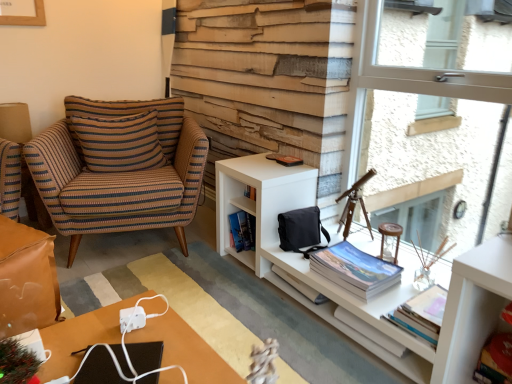
Question: Is hardcover book at lower right, which is counted as the 4th book, starting from the left, inside transparent glass window at upper right?

Choices:
 (A) no
 (B) yes

Answer: (A)

Question: Considering the relative positions of transparent glass window at upper right and hardcover book at lower right, which is counted as the 4th book, starting from the left, in the image provided, is transparent glass window at upper right to the left of hardcover book at lower right, which is counted as the 4th book, starting from the left, from the viewer's perspective?

Choices:
 (A) no
 (B) yes

Answer: (B)

Question: From the image's perspective, is transparent glass window at upper right located beneath hardcover book at lower right, which is counted as the 4th book, starting from the left?

Choices:
 (A) no
 (B) yes

Answer: (A)

Question: Is transparent glass window at upper right completely or partially outside of hardcover book at lower right, which is counted as the 4th book, starting from the left?

Choices:
 (A) no
 (B) yes

Answer: (B)

Question: Considering the relative sizes of transparent glass window at upper right and hardcover book at lower right, placed as the first book when sorted from right to left, in the image provided, is transparent glass window at upper right smaller than hardcover book at lower right, placed as the first book when sorted from right to left,?

Choices:
 (A) no
 (B) yes

Answer: (A)

Question: Is transparent glass window at upper right in contact with hardcover book at lower right, placed as the first book when sorted from right to left?

Choices:
 (A) no
 (B) yes

Answer: (A)

Question: Are green matte christmas tree at lower left and matte paper book at lower right, the 3th book in the right-to-left sequence, far apart?

Choices:
 (A) yes
 (B) no

Answer: (A)

Question: From the image's perspective, would you say green matte christmas tree at lower left is shown under matte paper book at lower right, the second book when ordered from left to right?

Choices:
 (A) no
 (B) yes

Answer: (B)

Question: Does green matte christmas tree at lower left have a smaller size compared to matte paper book at lower right, the second book when ordered from left to right?

Choices:
 (A) no
 (B) yes

Answer: (B)

Question: Is green matte christmas tree at lower left facing towards matte paper book at lower right, the 3th book in the right-to-left sequence?

Choices:
 (A) no
 (B) yes

Answer: (A)

Question: From the image's perspective, is green matte christmas tree at lower left located above matte paper book at lower right, the 3th book in the right-to-left sequence?

Choices:
 (A) yes
 (B) no

Answer: (B)

Question: Considering the relative positions of green matte christmas tree at lower left and matte paper book at lower right, the second book when ordered from left to right, in the image provided, is green matte christmas tree at lower left in front of matte paper book at lower right, the second book when ordered from left to right,?

Choices:
 (A) yes
 (B) no

Answer: (A)

Question: Is white paper book at center, the 3th book positioned from the left, thinner than matte paper book at lower right, the second book when ordered from left to right?

Choices:
 (A) no
 (B) yes

Answer: (B)